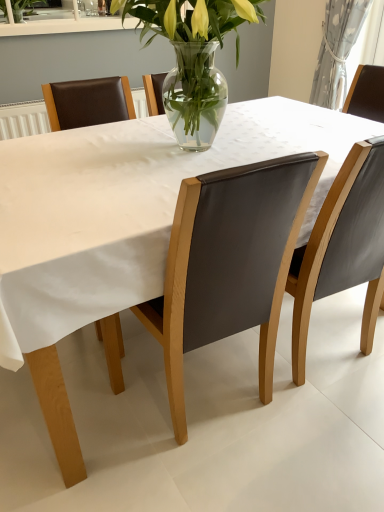
You are a GUI agent. You are given a task and a screenshot of the screen. Output one action in this format:
    pyautogui.click(x=<x>, y=<y>)
    Task: Click on the vacant space situated on the left part of leather at center, the 2th chair viewed from the right
    Image resolution: width=384 pixels, height=512 pixels.
    Given the screenshot: What is the action you would take?
    pyautogui.click(x=116, y=419)